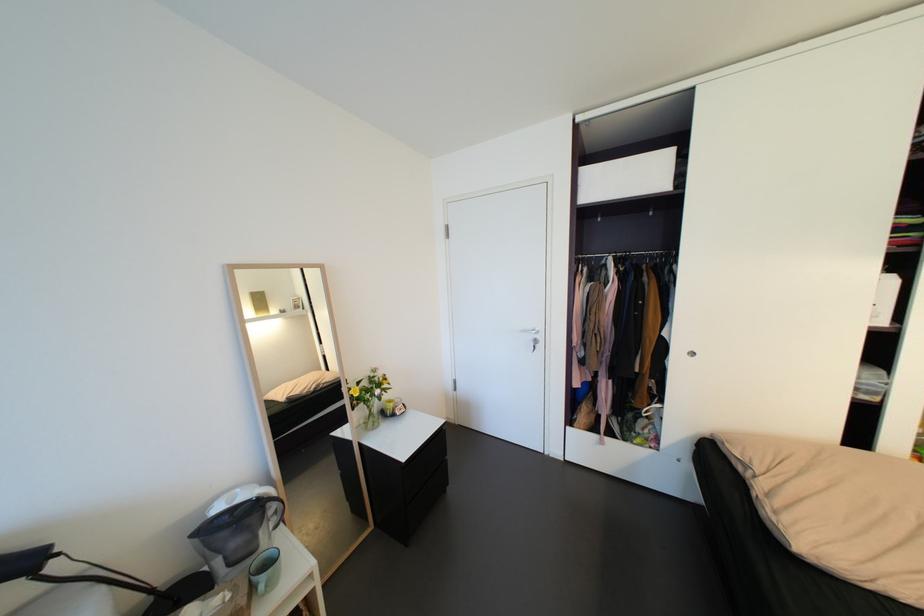
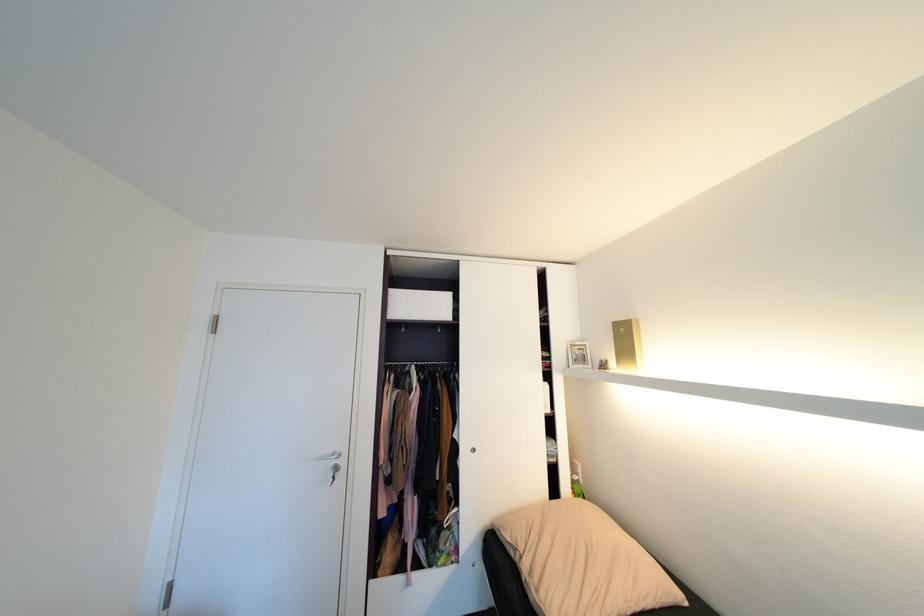
In the second image, find the point that corresponds to point 747,468 in the first image.

(518, 554)